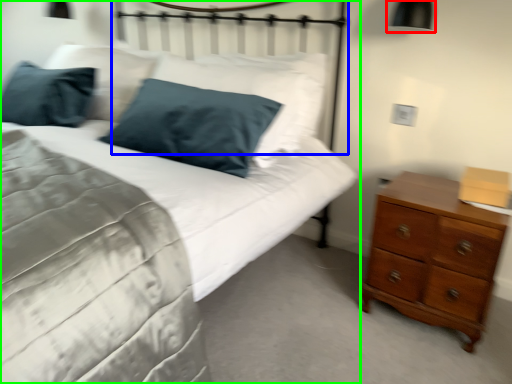
Question: Estimate the real-world distances between objects in this image. Which object is closer to bedside lamp (highlighted by a red box), headboard (highlighted by a blue box) or bed (highlighted by a green box)?

Choices:
 (A) headboard
 (B) bed

Answer: (A)